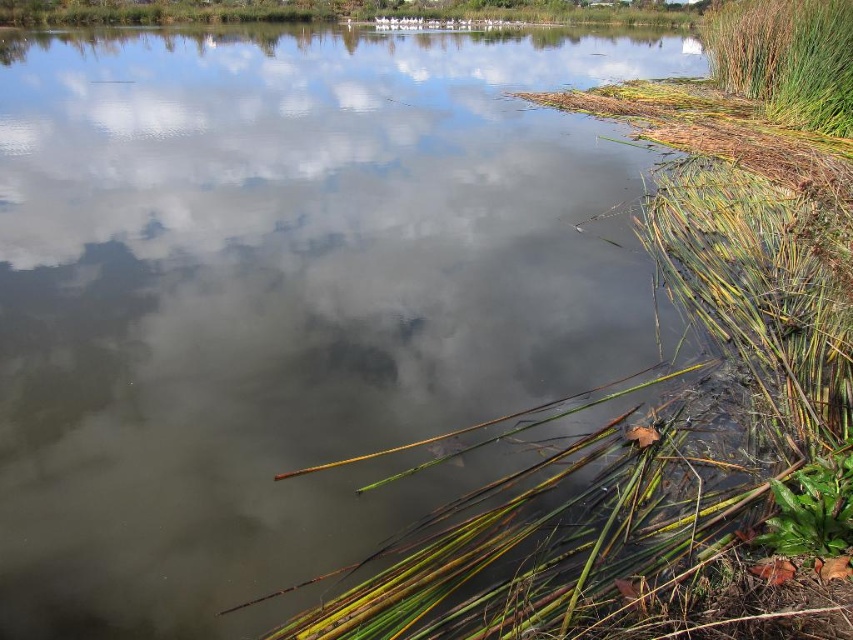
Consider the image. Who is shorter, green grass at right or green leafy plant at lower right?

green leafy plant at lower right

Can you confirm if green grass at right is thinner than green leafy plant at lower right?

Incorrect, green grass at right's width is not less than green leafy plant at lower right's.

Is point (839, 92) less distant than point (828, 472)?

No, (839, 92) is behind (828, 472).

Find the location of a particular element. This screenshot has height=640, width=853. green grass at right is located at coordinates (786, 58).